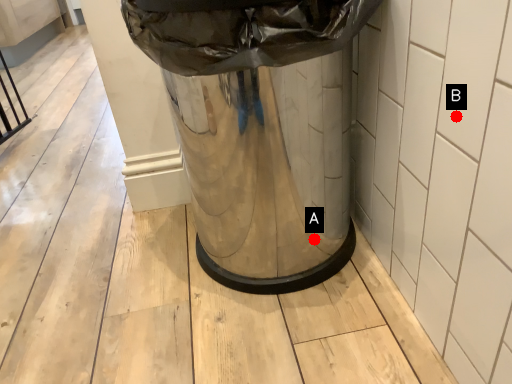
Question: Two points are circled on the image, labeled by A and B beside each circle. Which point appears closest to the camera in this image?

Choices:
 (A) A is closer
 (B) B is closer

Answer: (B)